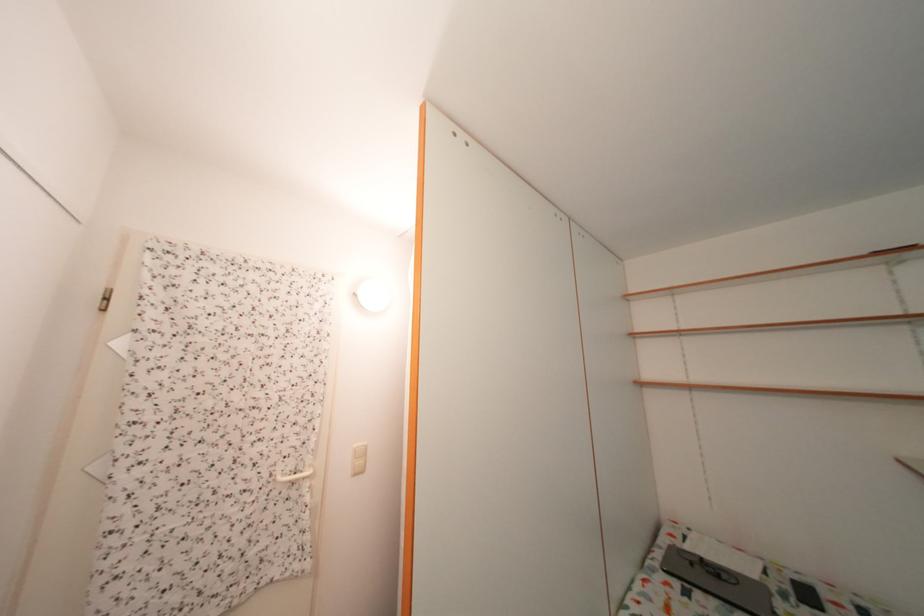
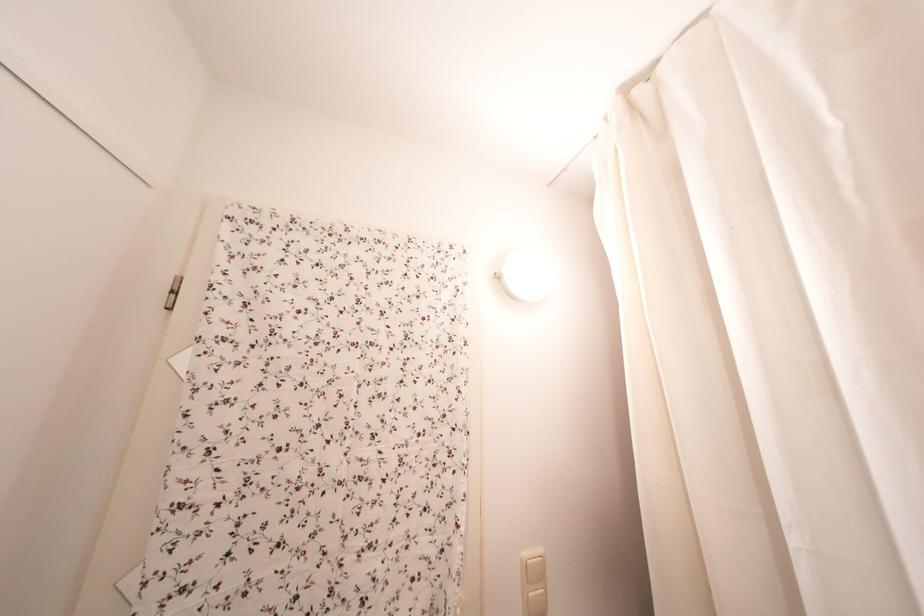
Question: The images are taken continuously from a first-person perspective. In which direction is your viewpoint rotating?

Choices:
 (A) Left
 (B) Right
 (C) Up
 (D) Down

Answer: (A)